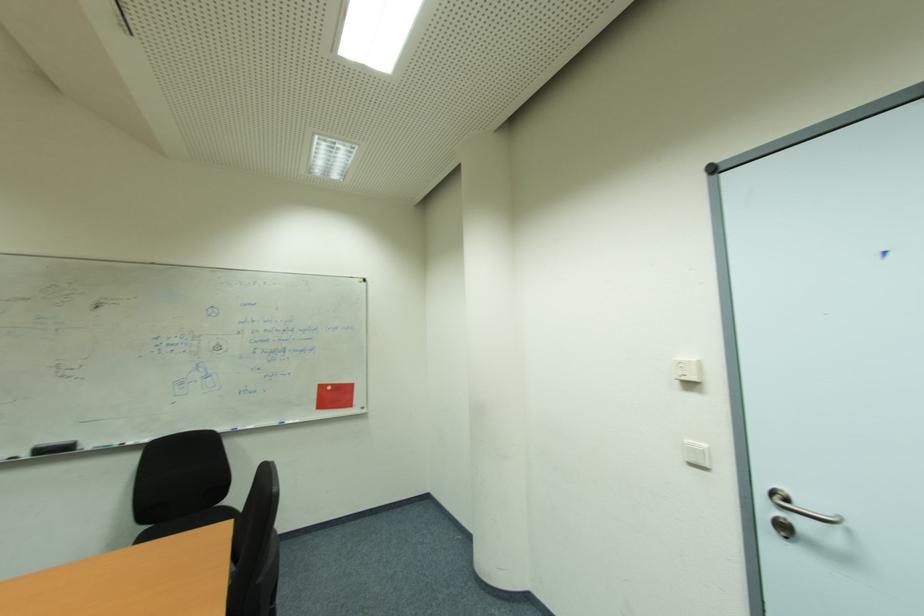
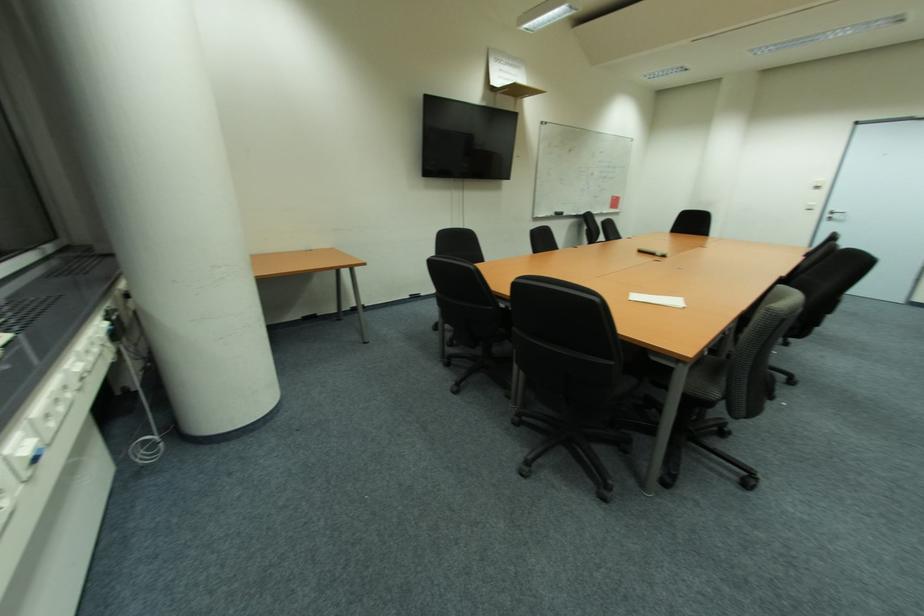
In the second image, find the point that corresponds to point (681, 384) in the first image.

(820, 188)